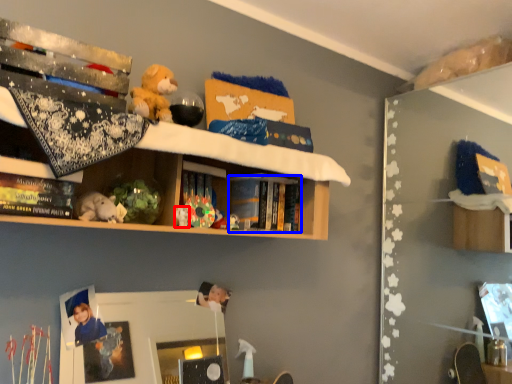
Question: Which point is closer to the camera, toy (highlighted by a red box) or book (highlighted by a blue box)?

Choices:
 (A) toy
 (B) book

Answer: (A)